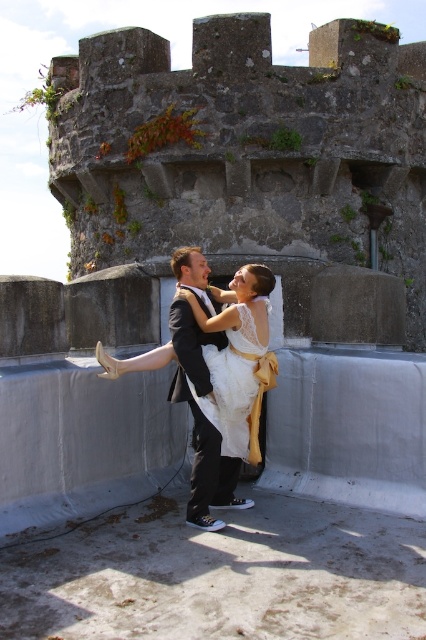
You are a photographer at the wedding and need to adjust the lighting to highlight both the white satin dress at center and the white lace dress at center. Since they are both white, you need to know their positions to set the lights properly. Which dress is positioned to the left side?

The white satin dress at center is positioned to the left of the white lace dress at center.